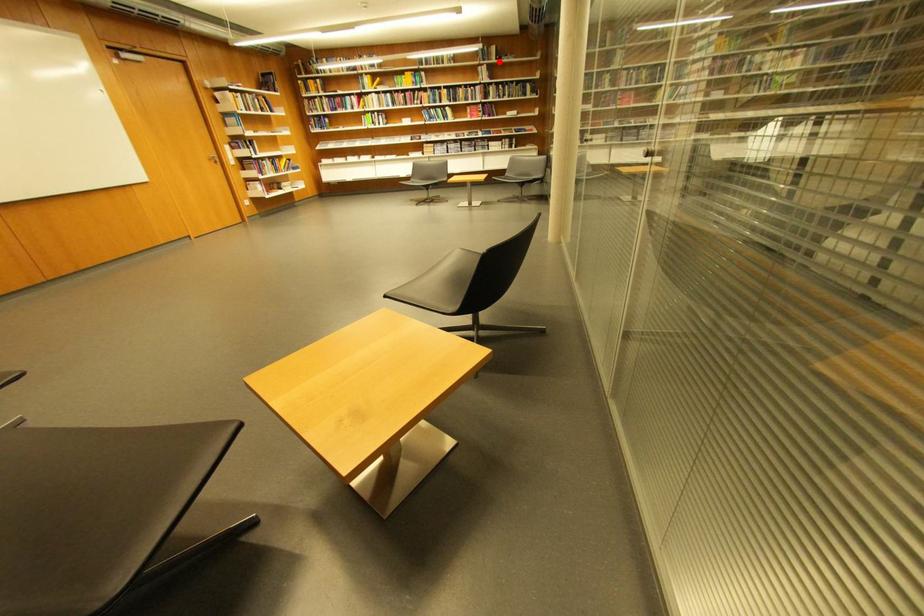
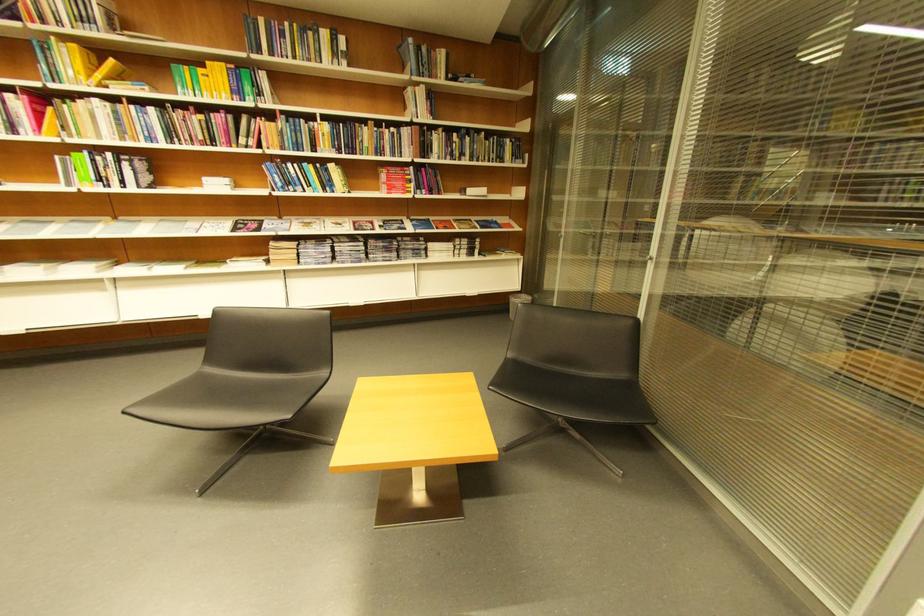
Where in the second image is the point corresponding to the highlighted location from the first image?

(441, 78)